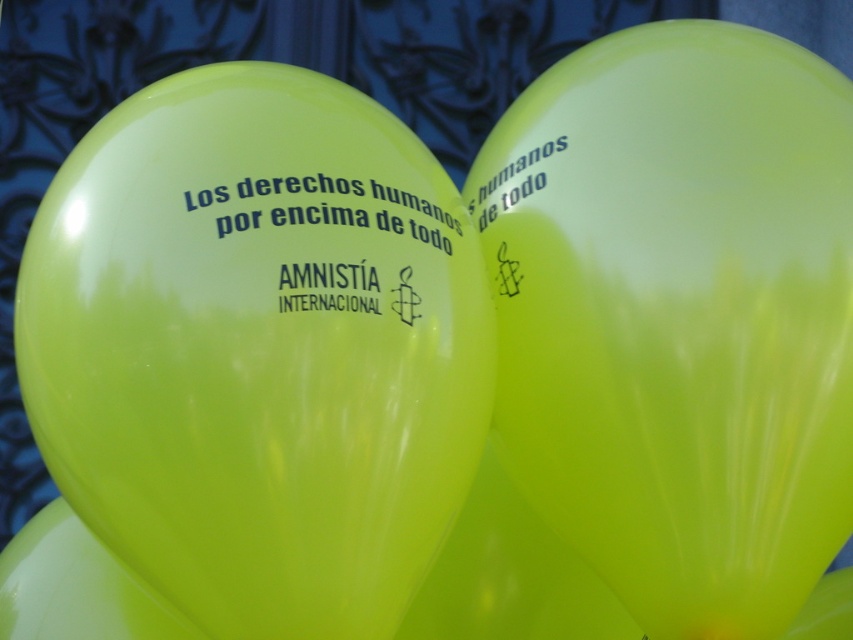
You are a photographer adjusting your camera settings to capture the lime matte balloon at center. The camera has a focus point at coordinate point [682,320]. Will the lime matte balloon at center be in focus if you use this point?

Yes, the lime matte balloon at center will be in focus because the focus point at coordinate point [682,320] is exactly where the lime matte balloon at center is located.

You are a photographer trying to capture both balloons in a single shot. Since the lime green latex balloon at center and the lime matte balloon at center are both at the center, which one appears smaller in the frame?

The lime green latex balloon at center has a lesser width compared to the lime matte balloon at center, so it appears smaller in the frame.

You are organizing a human rights event and have these two balloons displayed in the center. Which balloon is placed lower, the lime matte balloon at center or the green glossy balloon at center?

The lime matte balloon at center is positioned under the green glossy balloon at center, so it is placed lower.